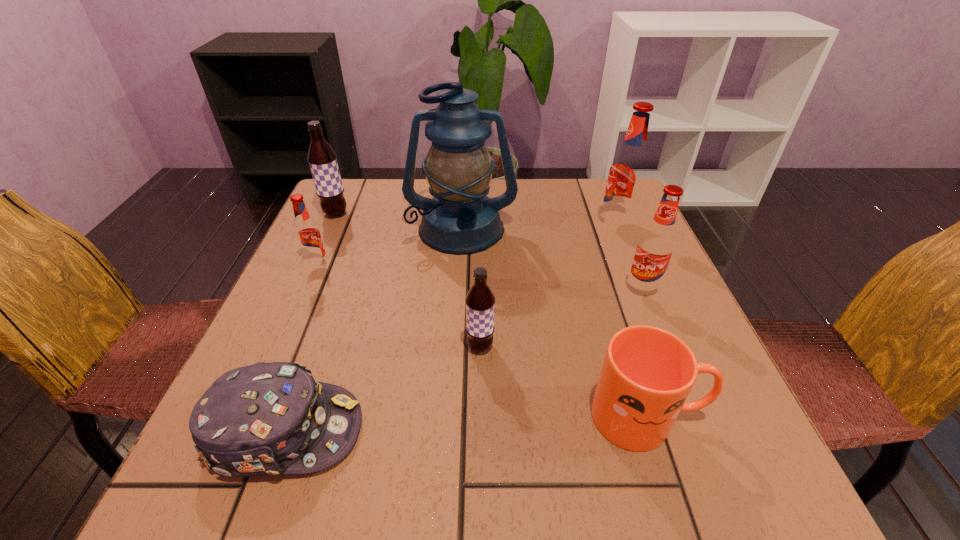
The height and width of the screenshot is (540, 960). What are the coordinates of `free space located on the handle side of the orange mug` in the screenshot? It's located at (739, 416).

At what (x,y) coordinates should I click in order to perform the action: click on vacant region located 0.160m on the front-facing side of the shortest object. Please return your answer as a coordinate pair (x, y). The width and height of the screenshot is (960, 540). Looking at the image, I should click on (466, 430).

What are the coordinates of `lantern located in the far edge section of the desktop` in the screenshot? It's located at (460, 219).

In order to click on mug present at the near edge in this screenshot , I will do `click(647, 374)`.

At what (x,y) coordinates should I click in order to perform the action: click on headwear present at the near edge. Please return your answer as a coordinate pair (x, y). Looking at the image, I should click on (267, 418).

Identify the location of headwear located in the left edge section of the desktop. (267, 418).

At what (x,y) coordinates should I click in order to perform the action: click on mug that is at the right edge. Please return your answer as a coordinate pair (x, y). Looking at the image, I should click on (647, 374).

You are a GUI agent. You are given a task and a screenshot of the screen. Output one action in this format:
    pyautogui.click(x=<x>, y=<y>)
    Task: Click on the object that is at the far left corner
    This screenshot has width=960, height=540.
    Given the screenshot: What is the action you would take?
    pyautogui.click(x=322, y=159)

This screenshot has height=540, width=960. I want to click on object positioned at the near left corner, so click(267, 418).

The image size is (960, 540). In order to click on object positioned at the far right corner in this screenshot , I will do `click(628, 171)`.